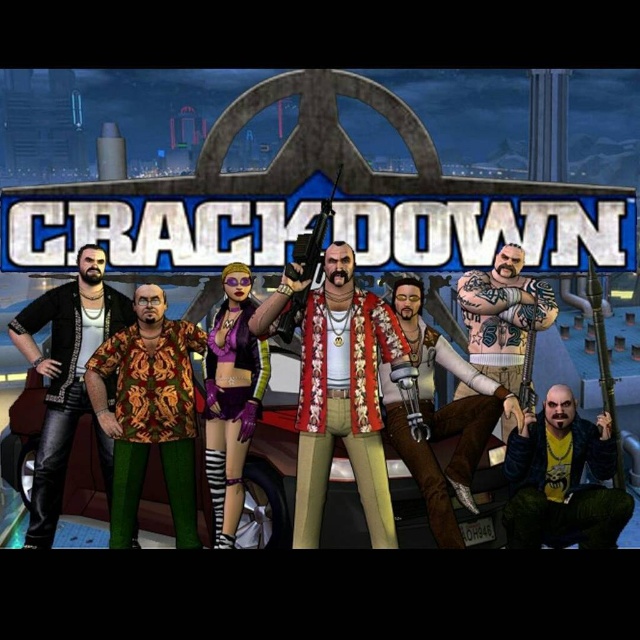
From the picture: You are a character in the game Crackdown and need to grab the printed fabric shirt at center. If your grappling hook can reach up to 20 meters, will you be able to reach it?

The printed fabric shirt at center is 21.80 meters away from the viewer, which is beyond the grappling hook range of 20 meters. You cannot reach it with the grappling hook.